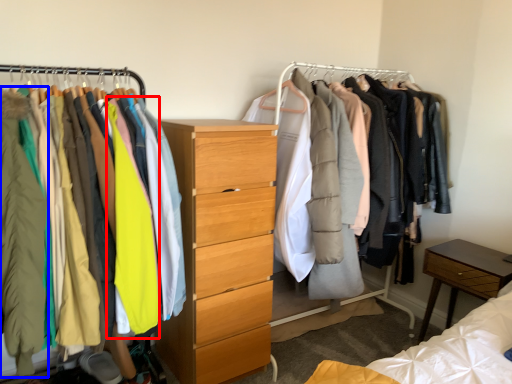
Question: Which of the following is the farthest to the observer, clothing (highlighted by a red box) or clothing (highlighted by a blue box)?

Choices:
 (A) clothing
 (B) clothing

Answer: (A)